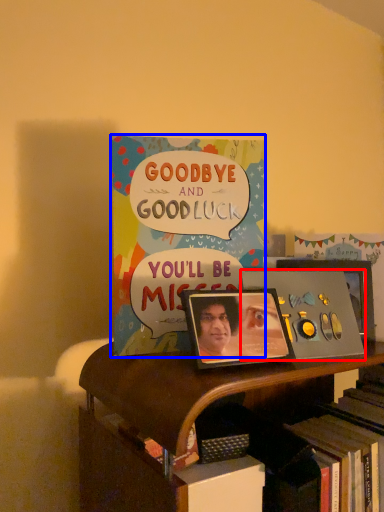
Question: Which of the following is the farthest to the observer, album cover (highlighted by a red box) or book (highlighted by a blue box)?

Choices:
 (A) album cover
 (B) book

Answer: (B)